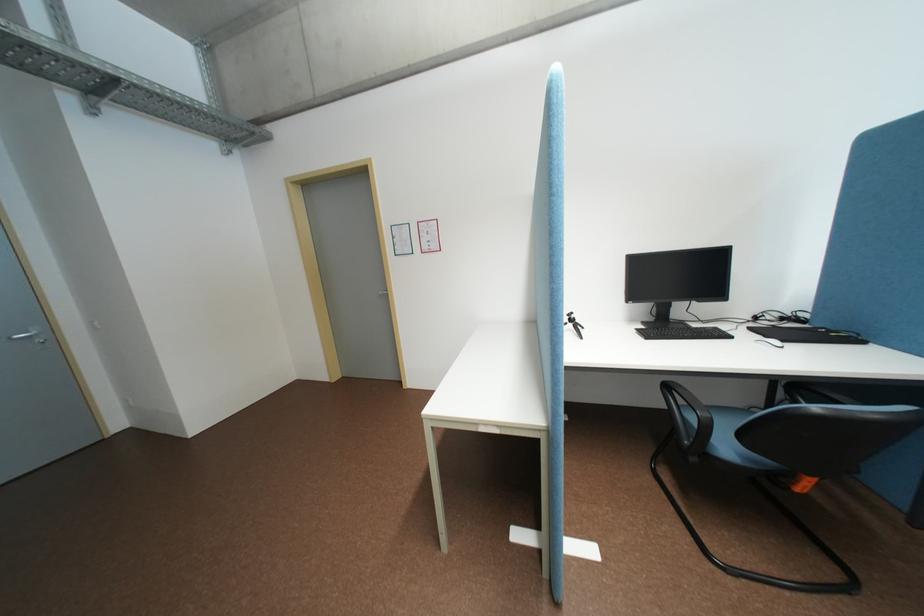
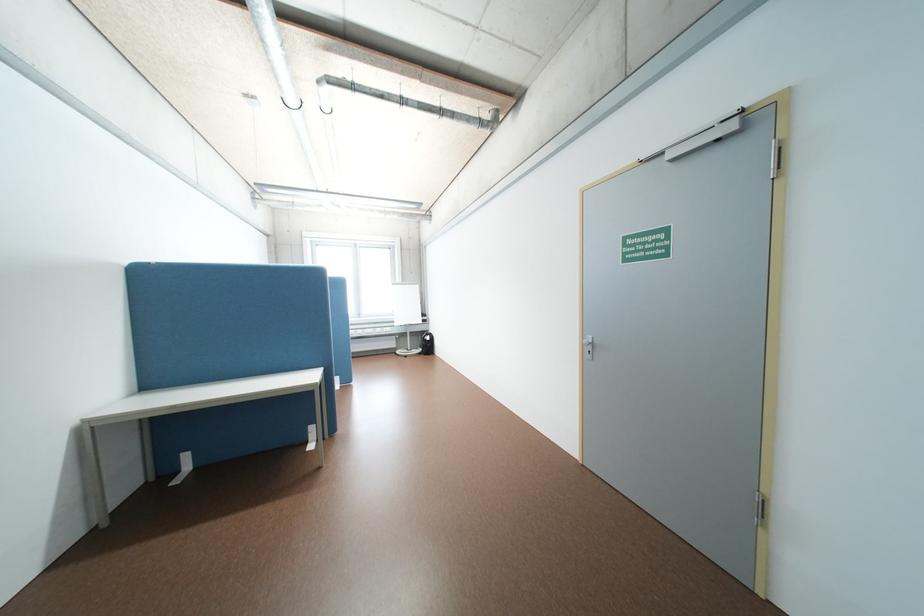
Question: I am providing you with two images of the same scene from different viewpoints. Please identify which objects are invisible in image2.

Choices:
 (A) metal door handle
 (B) blue chair sitting surface
 (C) black backpack
 (D) yellow top bottle

Answer: (B)